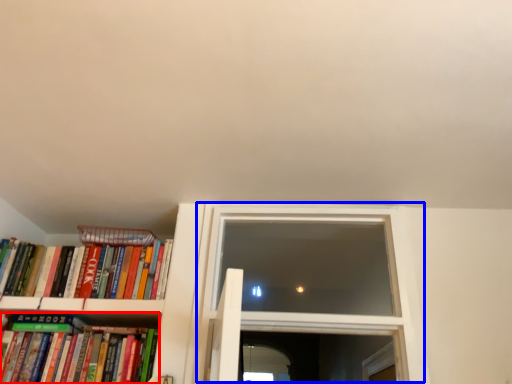
Question: Which object is further to the camera taking this photo, book (highlighted by a red box) or window (highlighted by a blue box)?

Choices:
 (A) book
 (B) window

Answer: (B)